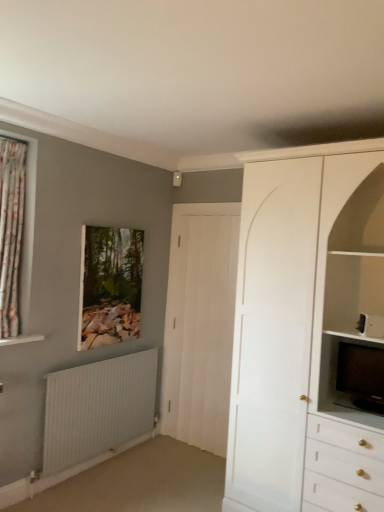
Identify the location of blank space situated above floral fabric curtain at left (from a real-world perspective). (18, 138).